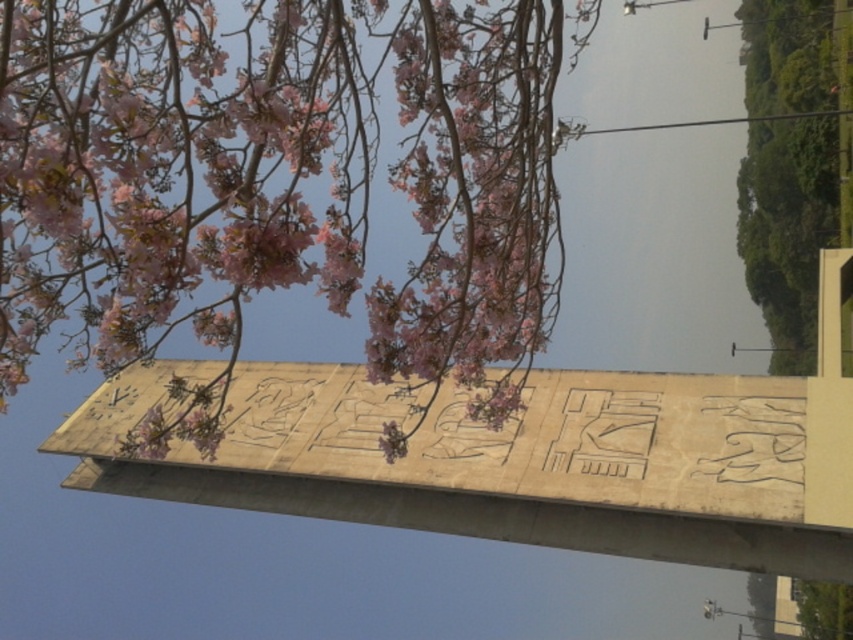
Question: Based on their relative distances, which object is farther from the pink matte flowers at upper center?

Choices:
 (A) beige stone obelisk at center
 (B) green leafy tree at upper right

Answer: (B)

Question: Does beige stone obelisk at center come behind green leafy tree at upper right?

Choices:
 (A) yes
 (B) no

Answer: (B)

Question: Which point is closer to the camera taking this photo?

Choices:
 (A) (492, 444)
 (B) (465, 163)

Answer: (B)

Question: Considering the relative positions of beige stone obelisk at center and green leafy tree at upper right in the image provided, where is beige stone obelisk at center located with respect to green leafy tree at upper right?

Choices:
 (A) above
 (B) below

Answer: (B)

Question: Which point is farther to the camera?

Choices:
 (A) (775, 49)
 (B) (108, 474)
 (C) (396, 184)

Answer: (A)

Question: Is pink matte flowers at upper center smaller than green leafy tree at upper right?

Choices:
 (A) no
 (B) yes

Answer: (B)